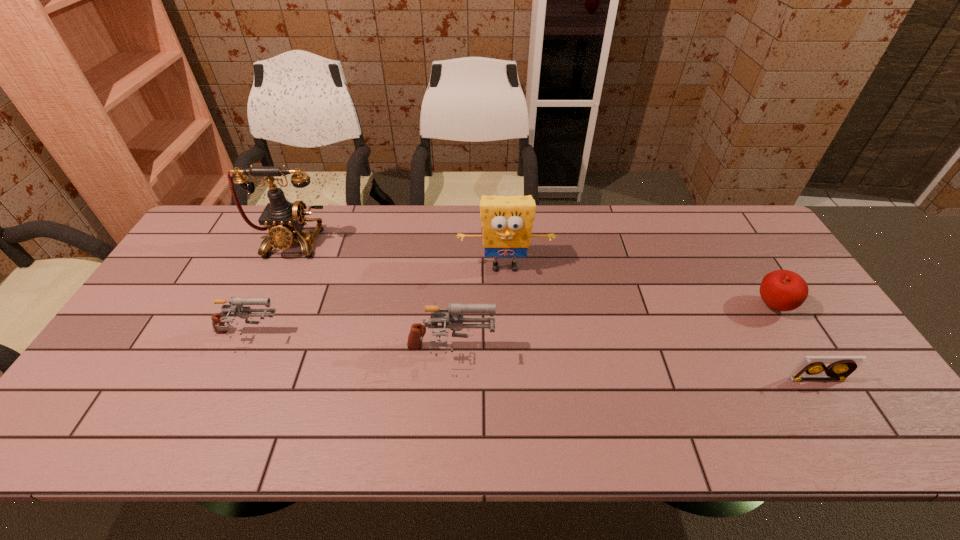
At what (x,y) coordinates should I click in order to perform the action: click on vacant space at the near edge. Please return your answer as a coordinate pair (x, y). Looking at the image, I should click on (470, 382).

Where is `vacant space at the left edge of the desktop`? The height and width of the screenshot is (540, 960). vacant space at the left edge of the desktop is located at coordinates (171, 327).

The image size is (960, 540). In the image, there is a desktop. What are the coordinates of `vacant space at the right edge` in the screenshot? It's located at (760, 314).

Find the location of a particular element. vacant space at the far right corner of the desktop is located at coordinates 700,207.

Where is `vacant space in between the nearest object and the shorter gun`? The height and width of the screenshot is (540, 960). vacant space in between the nearest object and the shorter gun is located at coordinates (532, 357).

Locate an element on the screen. The image size is (960, 540). free spot between the fifth shortest object and the nearest object is located at coordinates (660, 323).

The image size is (960, 540). Identify the location of vacant space that is in between the apple and the shorter gun. pyautogui.click(x=510, y=321).

Where is `vacant space that is in between the apple and the third tallest object`? Image resolution: width=960 pixels, height=540 pixels. vacant space that is in between the apple and the third tallest object is located at coordinates (612, 329).

The width and height of the screenshot is (960, 540). What are the coordinates of `vacant area that lies between the sponge and the apple` in the screenshot? It's located at (638, 286).

Locate an element on the screen. Image resolution: width=960 pixels, height=540 pixels. free area in between the telephone and the fifth shortest object is located at coordinates (398, 254).